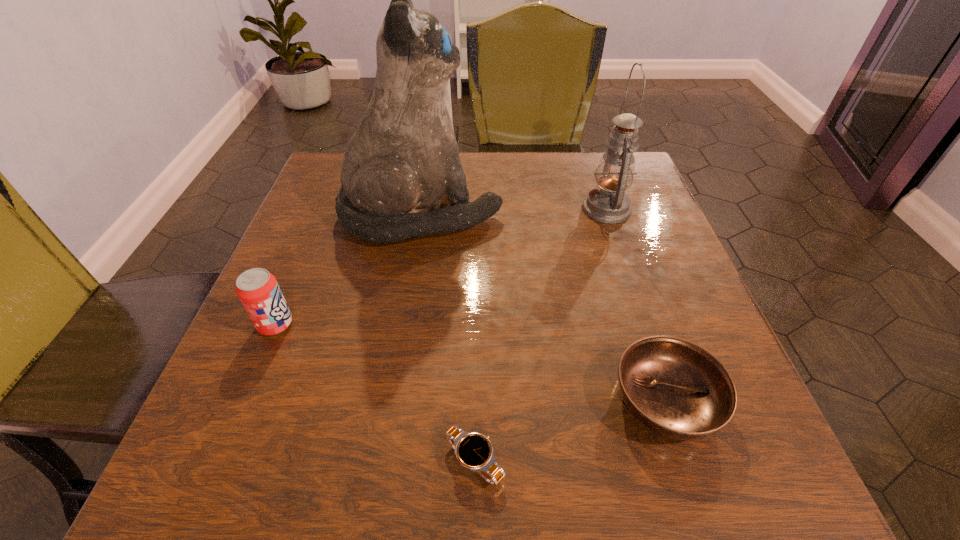
I want to click on vacant area in the image that satisfies the following two spatial constraints: 1. on the front side of the oil lamp; 2. on the surface of the third farthest object, so click(645, 325).

Identify the location of free space that satisfies the following two spatial constraints: 1. on the surface of the shortest object; 2. on the right side of the third shortest object. (218, 461).

Identify the location of vacant point that satisfies the following two spatial constraints: 1. on the back side of the oil lamp; 2. on the right side of the shortest object. (477, 209).

Identify the location of free point that satisfies the following two spatial constraints: 1. at the face of the tallest object; 2. on the left side of the watch. (384, 461).